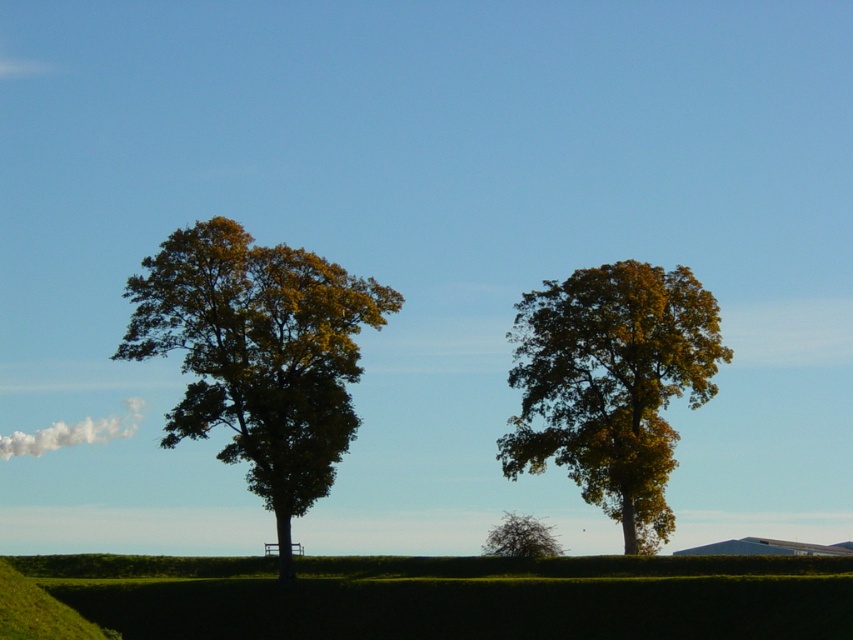
You are a gardener planning to prune the green hedge at center and the golden yellow leaves at center. Based on their positions, which one should you tackle first without needing to move around the other?

The green hedge at center is below the golden yellow leaves at center, so you should prune the green hedge at center first before reaching the golden yellow leaves at center.